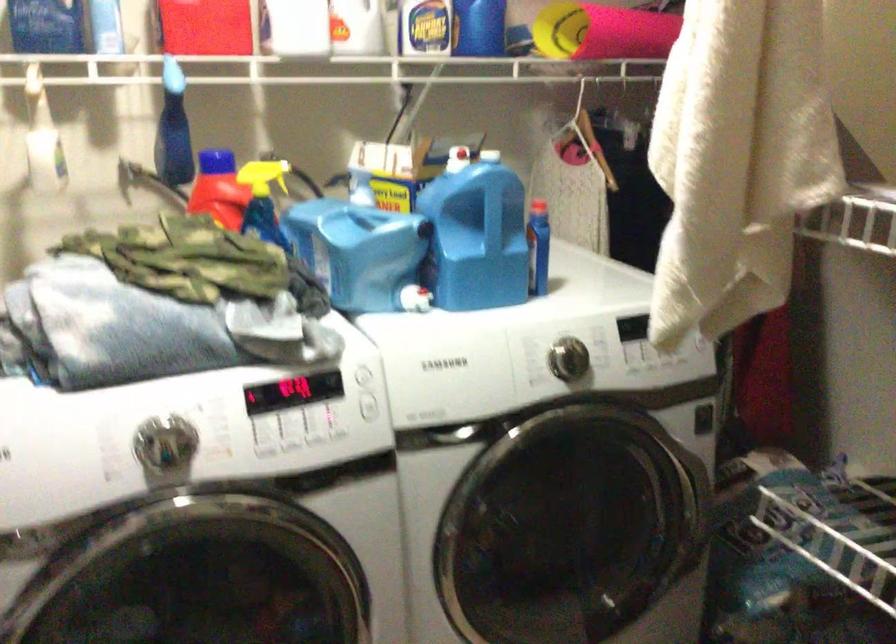
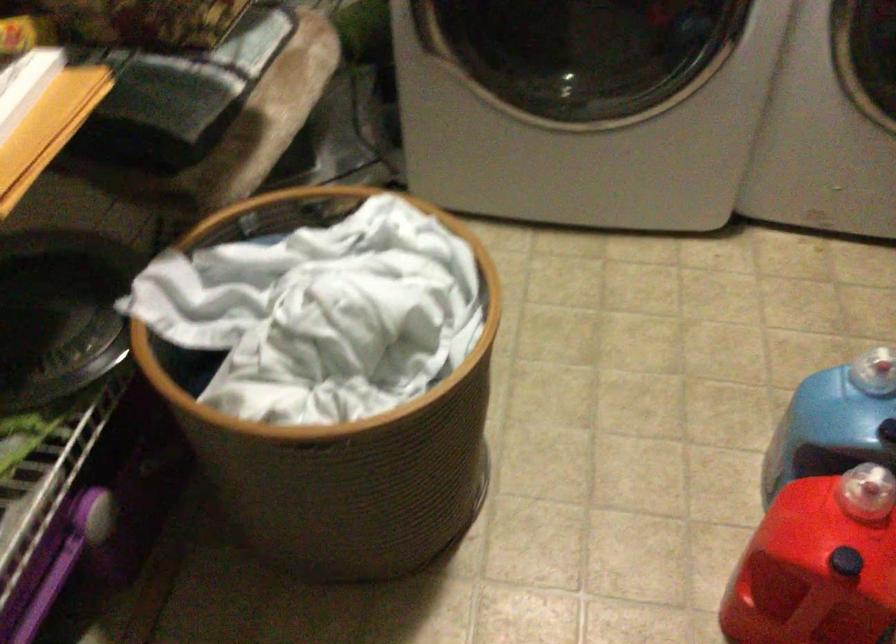
The images are taken continuously from a first-person perspective. In which direction is your viewpoint rotating?

The rotation direction of the camera is left-down.